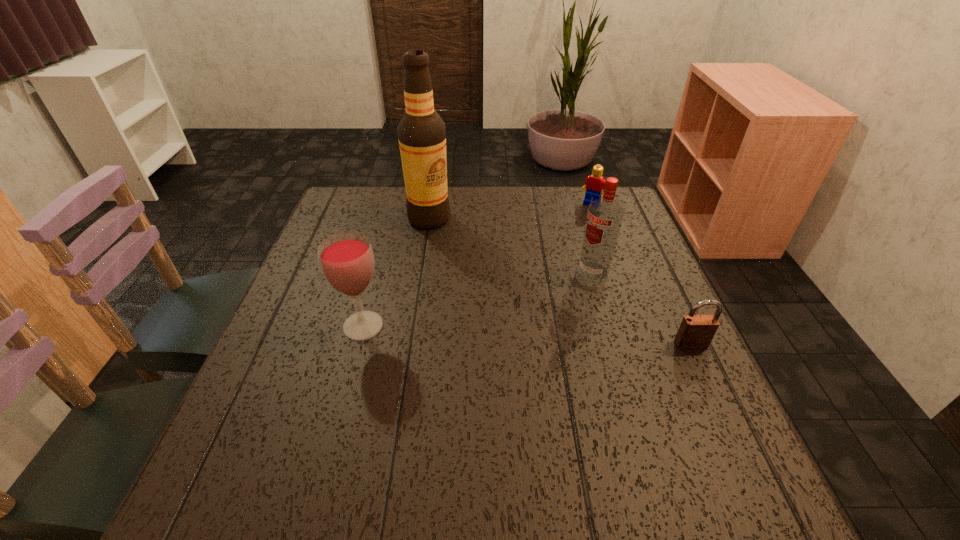
The image size is (960, 540). What are the coordinates of `blank space located 0.070m on the front label of the third nearest object` in the screenshot? It's located at (565, 291).

Where is `vacant area located 0.120m on the front-facing side of the Lego`? vacant area located 0.120m on the front-facing side of the Lego is located at coordinates (572, 227).

Locate an element on the screen. The height and width of the screenshot is (540, 960). free region located 0.350m on the front-facing side of the Lego is located at coordinates (538, 272).

I want to click on free spot located 0.190m on the front-facing side of the Lego, so click(563, 240).

I want to click on blank space located on the label of the tallest object, so click(x=460, y=281).

I want to click on vacant space located on the label of the tallest object, so click(x=466, y=292).

Where is `free region located 0.330m on the label of the tallest object`? This screenshot has height=540, width=960. free region located 0.330m on the label of the tallest object is located at coordinates (473, 308).

This screenshot has width=960, height=540. Find the location of `Lego present at the far edge`. Lego present at the far edge is located at coordinates (594, 184).

Identify the location of alcohol that is at the far edge. This screenshot has height=540, width=960. (421, 132).

Find the location of `object at the left edge`. object at the left edge is located at coordinates (346, 259).